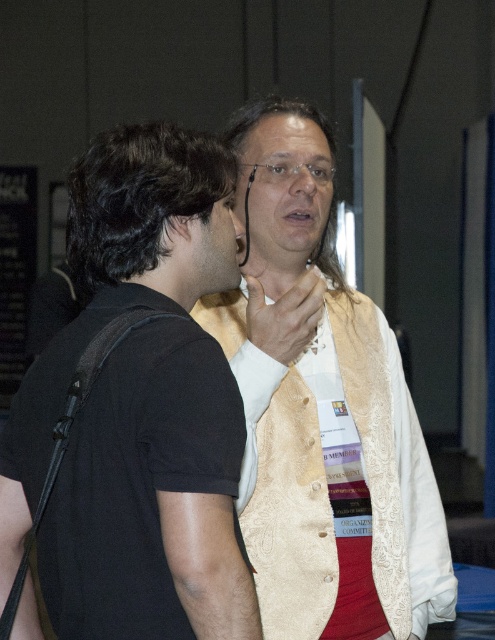
You are organizing a charity event and need to decide which item to prioritize packing. Based on the scene, which object takes up more space between the black fabric bag at left and the gold brocade vest at center?

The gold brocade vest at center occupies more space than the black fabric bag at left, so you should prioritize packing the gold brocade vest at center first.

You are a delivery person who needs to place a small package between the black fabric bag at left and the gold brocade vest at center. Can you fit it there?

The distance between the black fabric bag at left and the gold brocade vest at center is 19.44 inches, so yes, the small package can fit there as the space is sufficient.

What is the exact coordinate of the black fabric bag at left?

The black fabric bag at left is located at coordinate point (x=139, y=408).